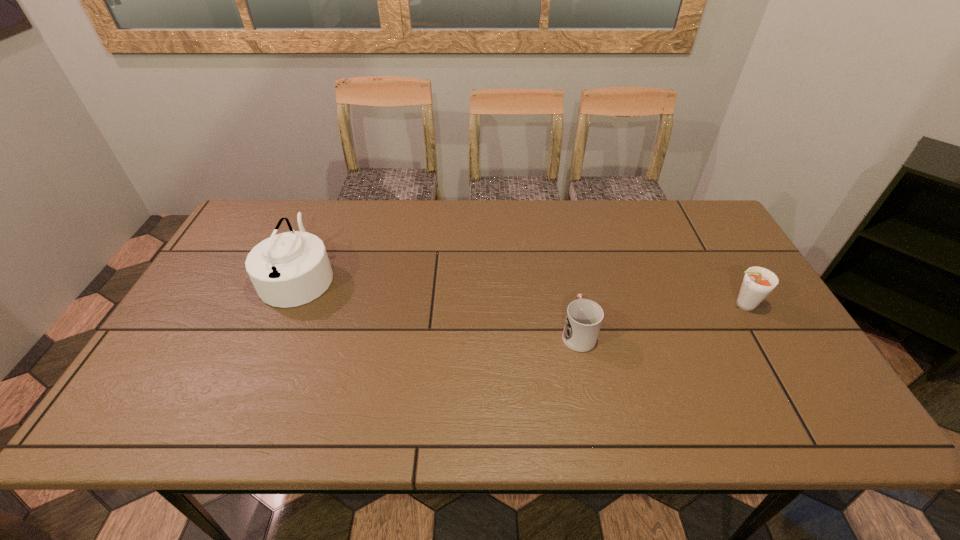
The height and width of the screenshot is (540, 960). I want to click on vacant space located on the side of the second object from left to right where the handle is located, so click(x=560, y=242).

The height and width of the screenshot is (540, 960). I want to click on vacant space located 0.390m on the side of the second object from left to right where the handle is located, so pos(556,224).

The image size is (960, 540). What are the coordinates of `vacant space located on the side of the second object from left to right where the handle is located` in the screenshot? It's located at (560, 244).

Locate an element on the screen. This screenshot has height=540, width=960. object located at the left edge is located at coordinates (290, 269).

The image size is (960, 540). Find the location of `object present at the right edge`. object present at the right edge is located at coordinates (758, 282).

In the image, there is a desktop. Where is `free space at the far edge`? This screenshot has width=960, height=540. free space at the far edge is located at coordinates (595, 215).

In the image, there is a desktop. Where is `vacant space at the near edge`? The image size is (960, 540). vacant space at the near edge is located at coordinates (423, 435).

At what (x,y) coordinates should I click in order to perform the action: click on free point at the left edge. Please return your answer as a coordinate pair (x, y). The width and height of the screenshot is (960, 540). Looking at the image, I should click on pyautogui.click(x=188, y=341).

In the image, there is a desktop. At what (x,y) coordinates should I click in order to perform the action: click on free space at the right edge. Please return your answer as a coordinate pair (x, y). Looking at the image, I should click on (717, 282).

Where is `vacant space at the near left corner of the desktop`? This screenshot has height=540, width=960. vacant space at the near left corner of the desktop is located at coordinates (144, 397).